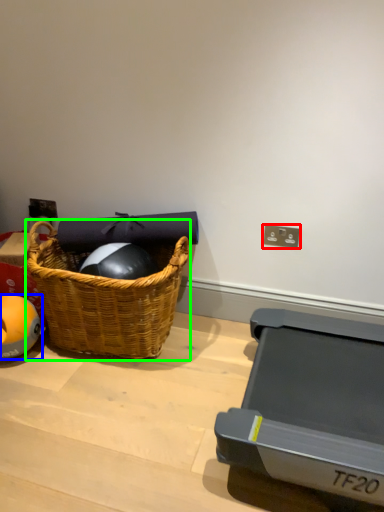
Question: Which object is the farthest from electric outlet (highlighted by a red box)? Choose among these: ball (highlighted by a blue box) or picnic basket (highlighted by a green box).

Choices:
 (A) ball
 (B) picnic basket

Answer: (A)